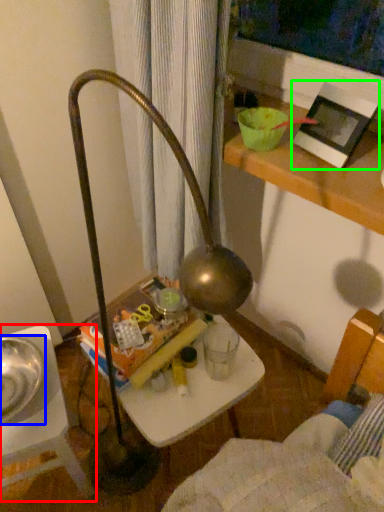
Question: Which object is the closest to the furniture (highlighted by a red box)? Choose among these: glass bowl (highlighted by a blue box) or picture frame (highlighted by a green box).

Choices:
 (A) glass bowl
 (B) picture frame

Answer: (A)